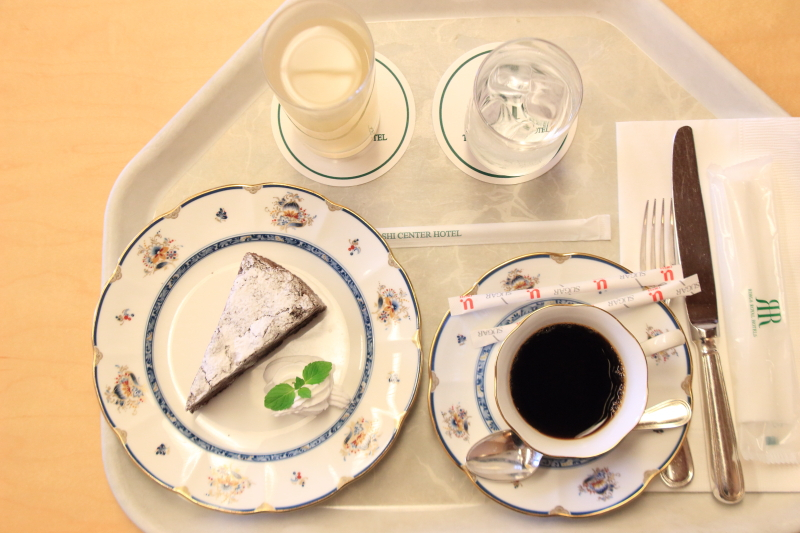
Locate an element on the screen. fork is located at coordinates (658, 253), (674, 457).